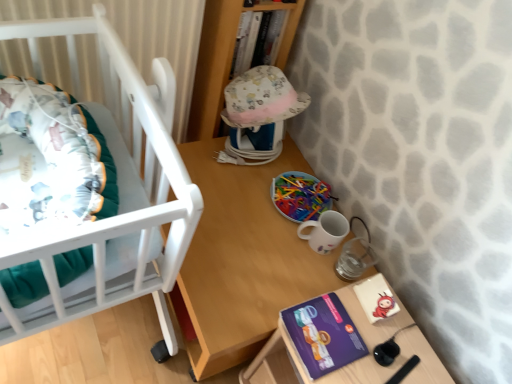
This screenshot has width=512, height=384. Find the location of `free space in front of multicolored plastic sticks at center`. free space in front of multicolored plastic sticks at center is located at coordinates (272, 241).